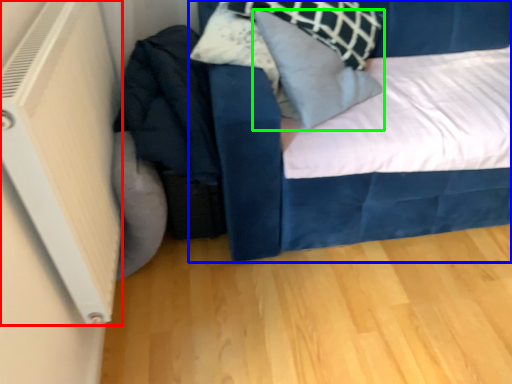
Question: Considering the real-world distances, which object is closest to air conditioning (highlighted by a red box)? bed (highlighted by a blue box) or pillow (highlighted by a green box).

Choices:
 (A) bed
 (B) pillow

Answer: (A)